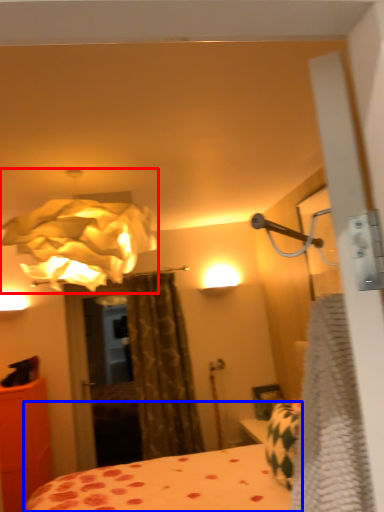
Question: Which of the following is the closest to the observer, lamp (highlighted by a red box) or bed (highlighted by a blue box)?

Choices:
 (A) lamp
 (B) bed

Answer: (B)